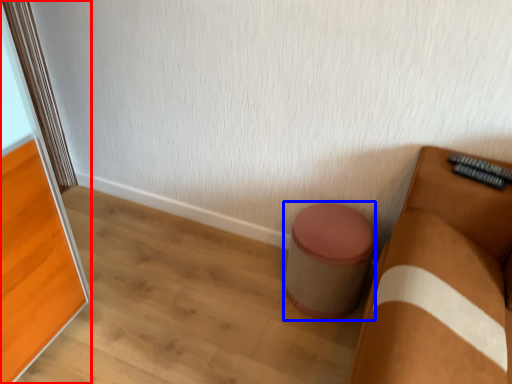
Question: Among these objects, which one is nearest to the camera, screen door (highlighted by a red box) or stool (highlighted by a blue box)?

Choices:
 (A) screen door
 (B) stool

Answer: (A)